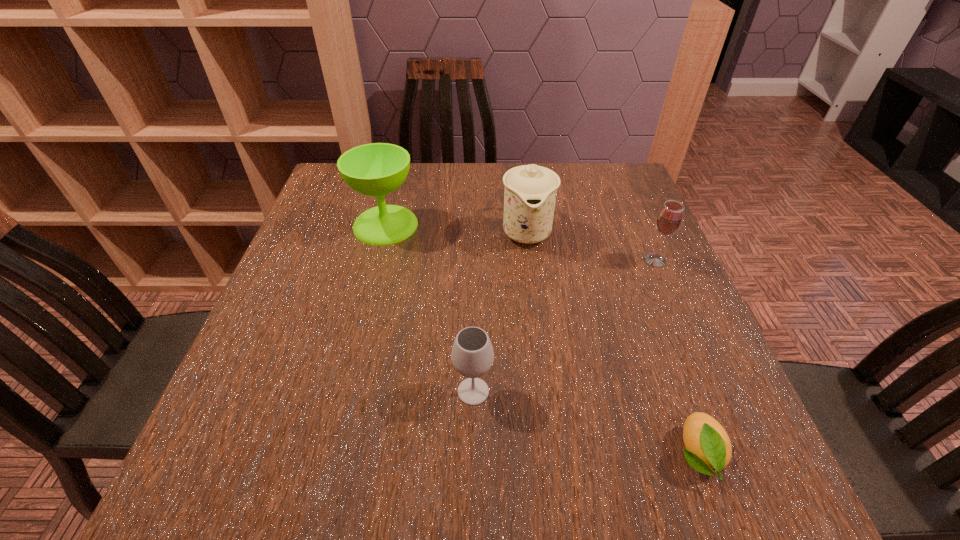
In order to click on free spot between the nearest object and the rightmost wineglass in this screenshot , I will do `click(676, 357)`.

The image size is (960, 540). I want to click on vacant point located between the leftmost object and the third object from right to left, so click(x=456, y=228).

At what (x,y) coordinates should I click in order to perform the action: click on free space that is in between the rightmost wineglass and the third object from right to left. Please return your answer as a coordinate pair (x, y). This screenshot has height=540, width=960. Looking at the image, I should click on (590, 246).

The width and height of the screenshot is (960, 540). What are the coordinates of `free point between the lemon and the chinaware` in the screenshot? It's located at (612, 343).

Where is `vacant space in between the nearest wineglass and the lemon`? The image size is (960, 540). vacant space in between the nearest wineglass and the lemon is located at coordinates (586, 423).

This screenshot has width=960, height=540. What are the coordinates of `object that is the closest to the fourth farthest object` in the screenshot? It's located at (708, 448).

Identify the location of the closest object to the rightmost wineglass. Image resolution: width=960 pixels, height=540 pixels. (530, 192).

Choose which wineglass is the nearest neighbor to the second nearest object. Please provide its 2D coordinates. Your answer should be formatted as a tuple, i.e. [(x, y)], where the tuple contains the x and y coordinates of a point satisfying the conditions above.

[(376, 169)]

At what (x,y) coordinates should I click in order to perform the action: click on wineglass that stands as the closest to the leftmost object. Please return your answer as a coordinate pair (x, y). The image size is (960, 540). Looking at the image, I should click on (472, 355).